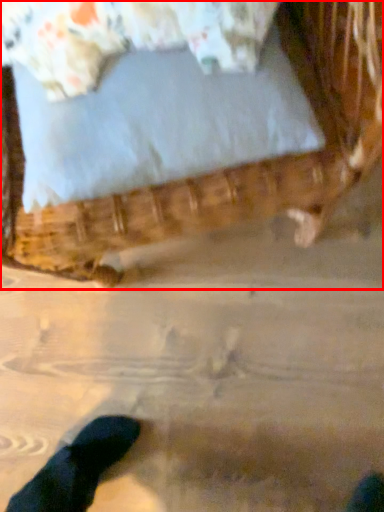
Question: From the image's perspective, what is the correct spatial positioning of furniture (annotated by the red box) in reference to pillow?

Choices:
 (A) above
 (B) below

Answer: (A)